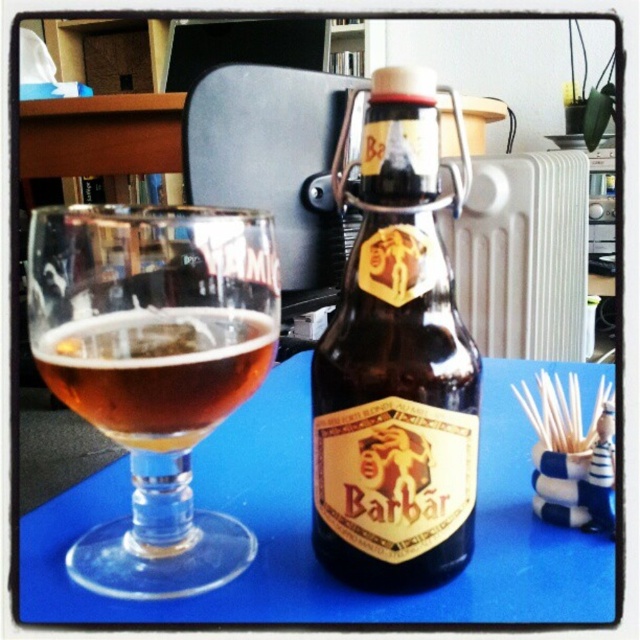
Is transparent glass wine glass at left to the right of blue matte table at center from the viewer's perspective?

No, transparent glass wine glass at left is not to the right of blue matte table at center.

Who is more distant from viewer, (273, 336) or (52, 600)?

The point (273, 336) is behind.

This screenshot has width=640, height=640. Describe the element at coordinates (154, 371) in the screenshot. I see `transparent glass wine glass at left` at that location.

In order to click on transparent glass wine glass at left in this screenshot , I will do `click(154, 371)`.

Which is above, transparent glass wine glass at left or white metallic radiator at center right?

white metallic radiator at center right is above.

Is transparent glass wine glass at left closer to the viewer compared to white metallic radiator at center right?

Yes.

Find the location of a particular element. Image resolution: width=640 pixels, height=640 pixels. transparent glass wine glass at left is located at coordinates (154, 371).

Which is in front, point (156, 380) or point (572, 164)?

Point (156, 380)

Measure the distance between amber glass at center and camera.

amber glass at center and camera are 10.02 inches apart.

Image resolution: width=640 pixels, height=640 pixels. Find the location of `amber glass at center`. amber glass at center is located at coordinates (157, 371).